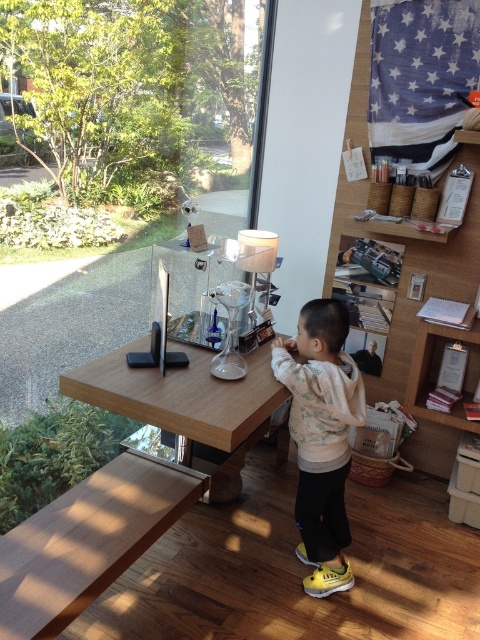
Between brown wood table at lower left and light pink fleece sweater at center, which one appears on the left side from the viewer's perspective?

brown wood table at lower left is more to the left.

Does brown wood table at lower left have a greater width compared to light pink fleece sweater at center?

Yes, brown wood table at lower left is wider than light pink fleece sweater at center.

In order to click on brown wood table at lower left in this screenshot , I will do `click(87, 541)`.

Who is positioned more to the right, wooden bookshelf at right or brown wood table at lower left?

wooden bookshelf at right

Identify the location of wooden bookshelf at right. This screenshot has width=480, height=640. [x=408, y=285].

This screenshot has height=640, width=480. In order to click on wooden bookshelf at right in this screenshot , I will do `click(408, 285)`.

Is wooden bookshelf at right shorter than wooden table at center?

In fact, wooden bookshelf at right may be taller than wooden table at center.

Between point (336, 189) and point (190, 440), which one is positioned behind?

Positioned behind is point (336, 189).

Who is more forward, [447,458] or [85,369]?

Point [85,369] is more forward.

I want to click on wooden bookshelf at right, so click(408, 285).